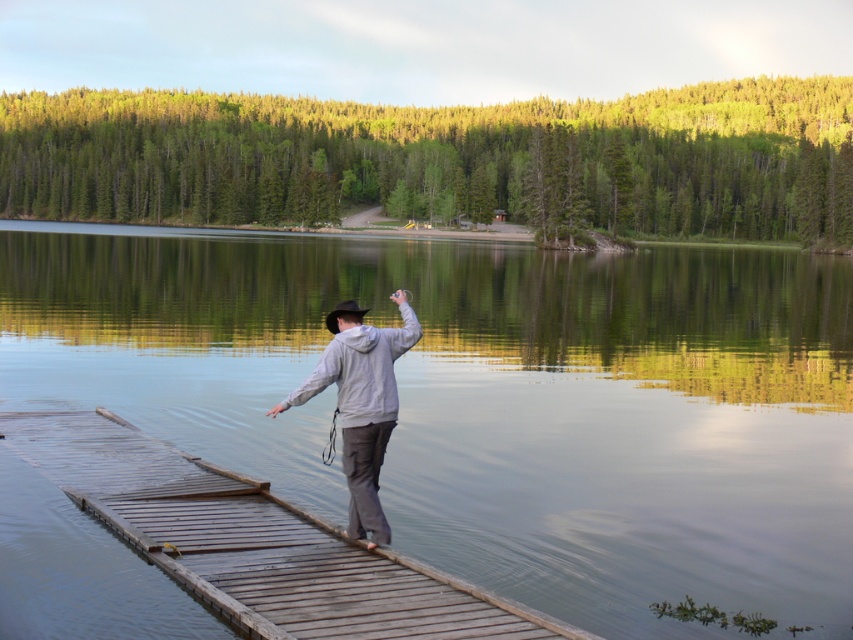
Who is positioned more to the right, wooden dock at center or gray matte hoodie at center?

gray matte hoodie at center

Measure the distance between wooden dock at center and gray matte hoodie at center.

A distance of 1.93 meters exists between wooden dock at center and gray matte hoodie at center.

Is point (68, 436) in front of point (355, 413)?

No, (68, 436) is further to viewer.

You are a GUI agent. You are given a task and a screenshot of the screen. Output one action in this format:
    pyautogui.click(x=<x>, y=<y>)
    Task: Click on the wooden dock at center
    Image resolution: width=853 pixels, height=640 pixels.
    Given the screenshot: What is the action you would take?
    pyautogui.click(x=254, y=541)

In the scene shown: Which of these two, smooth water at dock center or wooden dock at center, stands taller?

Standing taller between the two is smooth water at dock center.

Who is positioned more to the left, smooth water at dock center or wooden dock at center?

wooden dock at center

The image size is (853, 640). I want to click on smooth water at dock center, so click(491, 401).

Does smooth water at dock center have a larger size compared to gray matte hoodie at center?

Yes.

Is point (776, 557) positioned behind point (416, 340)?

Yes, point (776, 557) is behind point (416, 340).

Where is `smooth water at dock center`? This screenshot has width=853, height=640. smooth water at dock center is located at coordinates (491, 401).

Locate an element on the screen. Image resolution: width=853 pixels, height=640 pixels. smooth water at dock center is located at coordinates (491, 401).